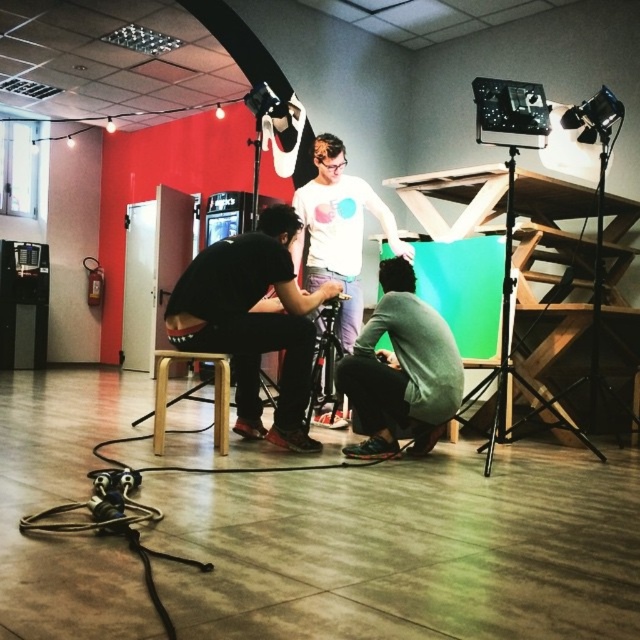
You are setting up a tripod for a camera in the studio. The tripod requires a flat surface that is at least 0.6 meters away from the black matte stool at center. Based on the studio layout, is there enough space to place the tripod at the required distance?

The black matte stool at center is located at point (252, 321). Since the required distance is 0.6 meters, and the coordinates indicate its position, there might be sufficient space depending on the studio dimensions. However, without knowing the studio size, an exact answer can not be determined.

You are setting up a video shoot in the studio. You need to adjust the position of the black matte stool at center so it is placed below the black metal tripod at upper right. Is the current arrangement already meeting this requirement?

The black matte stool at center is currently located above the black metal tripod at upper right, so it does not meet the requirement of placing it below the tripod. You will need to move the stool downward to position it beneath the tripod.

You are a photographer setting up equipment in the studio. You need to adjust the height of your camera to eye level. You have a black matte stool at center and a gray fabric squat at lower right. Which object should you use to reach the desired height?

The black matte stool at center has a greater height compared to the gray fabric squat at lower right, so you should use the black matte stool at center to reach the desired eye level.